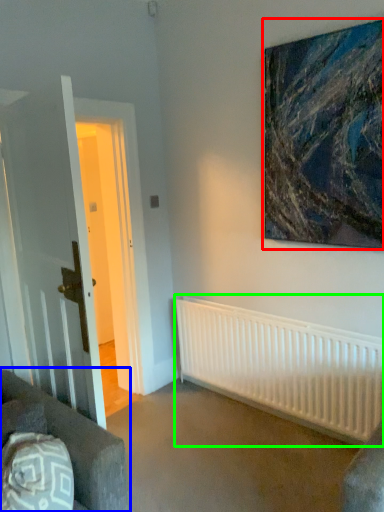
Question: Based on their relative distances, which object is farther from picture frame (highlighted by a red box)? Choose from studio couch (highlighted by a blue box) and radiator (highlighted by a green box).

Choices:
 (A) studio couch
 (B) radiator

Answer: (A)